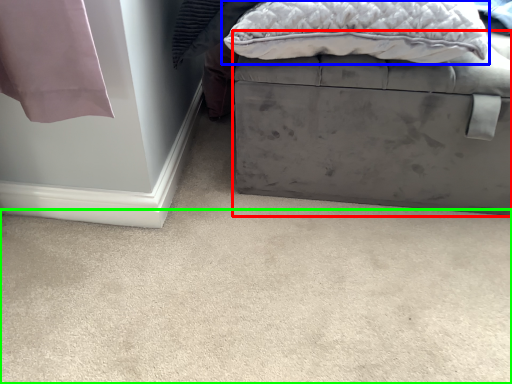
Question: Which object is the closest to the furniture (highlighted by a red box)? Choose among these: pillow (highlighted by a blue box) or concrete (highlighted by a green box).

Choices:
 (A) pillow
 (B) concrete

Answer: (A)